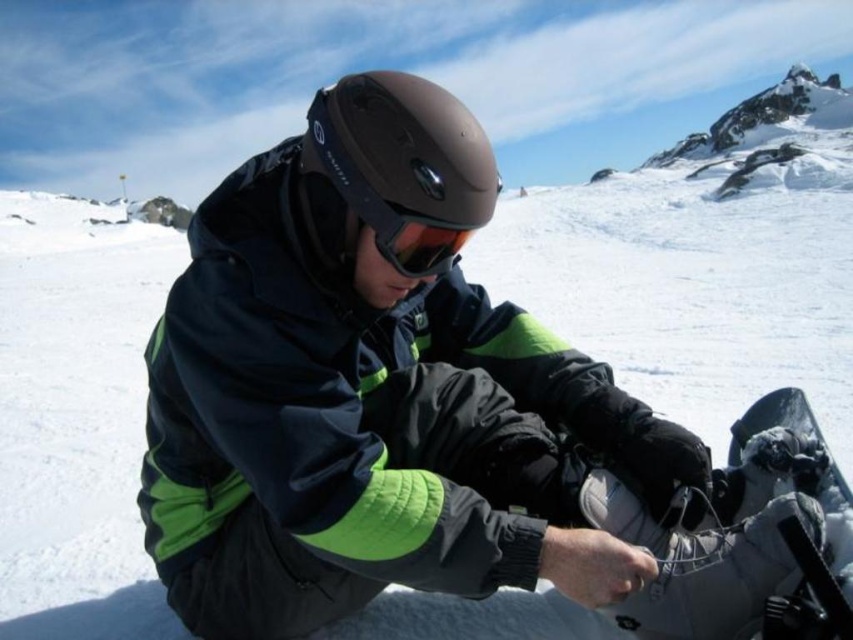
You are a winter sports instructor preparing to demonstrate equipment placement. You have a white matte snowboard at center and matte orange goggles at center. If you want to place them side by side on a shelf, which object should you position first to ensure they both fit?

The white matte snowboard at center is wider than the matte orange goggles at center, so you should position the white matte snowboard at center first to accommodate its width before placing the matte orange goggles at center.

You are a photographer trying to capture a clear shot of the matte brown helmet at center and the white matte snowboard at center. Since you want to focus on the helmet, which object should you adjust your camera focus on first considering their sizes in the frame?

The matte brown helmet at center has a greater height compared to the white matte snowboard at center, so you should focus on the matte brown helmet at center first as it is larger in the frame.

You are a photographer trying to capture the rider in the snowy landscape. You notice two helmets at center, a matte black helmet at center and a matte brown helmet at center. Which helmet appears larger in the photo?

The matte brown helmet at center appears larger because it has a bigger size compared to the matte black helmet at center.